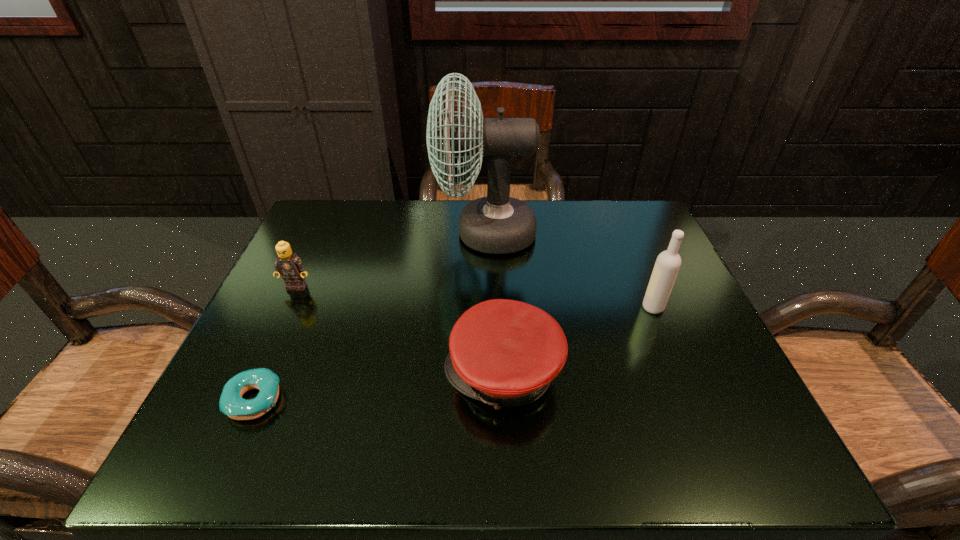
This screenshot has width=960, height=540. Identify the location of Lego at the left edge. (291, 267).

At what (x,y) coordinates should I click in order to perform the action: click on doughnut present at the left edge. Please return your answer as a coordinate pair (x, y). The image size is (960, 540). Looking at the image, I should click on (231, 403).

This screenshot has height=540, width=960. I want to click on object present at the right edge, so click(x=667, y=265).

Locate an element on the screen. The width and height of the screenshot is (960, 540). object located at the near left corner is located at coordinates (231, 403).

In the image, there is a desktop. Where is `free space at the far edge`? The image size is (960, 540). free space at the far edge is located at coordinates (581, 207).

You are a GUI agent. You are given a task and a screenshot of the screen. Output one action in this format:
    pyautogui.click(x=<x>, y=<y>)
    Task: Click on the free region at the near edge
    
    Given the screenshot: What is the action you would take?
    pyautogui.click(x=324, y=448)

The width and height of the screenshot is (960, 540). Find the location of `vacant space at the left edge of the desktop`. vacant space at the left edge of the desktop is located at coordinates (288, 302).

You are a GUI agent. You are given a task and a screenshot of the screen. Output one action in this format:
    pyautogui.click(x=<x>, y=<y>)
    Task: Click on the vacant space at the right edge of the desktop
    The image size is (960, 540).
    Given the screenshot: What is the action you would take?
    pyautogui.click(x=668, y=373)

At what (x,y) coordinates should I click in order to perform the action: click on vacant space at the far left corner of the desktop. Please return your answer as a coordinate pair (x, y). The image size is (960, 540). Looking at the image, I should click on (300, 241).

In the image, there is a desktop. Where is `vacant space at the near left corner`? This screenshot has height=540, width=960. vacant space at the near left corner is located at coordinates (280, 444).